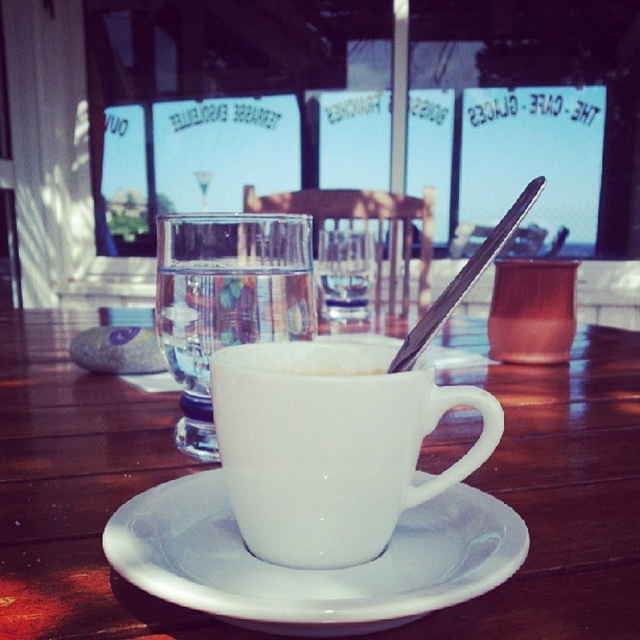
Question: Is the position of white ceramic cup at center less distant than that of clear glass water at center?

Choices:
 (A) yes
 (B) no

Answer: (A)

Question: Among these objects, which one is nearest to the camera?

Choices:
 (A) silver metallic spoon at upper center
 (B) white ceramic mug at center

Answer: (A)

Question: Is clear glass water at center further to the viewer compared to silver metallic spoon at upper center?

Choices:
 (A) yes
 (B) no

Answer: (A)

Question: Which of the following is the farthest from the observer?

Choices:
 (A) clear glass water at center
 (B) white ceramic cup at center
 (C) silver metallic spoon at upper center

Answer: (A)

Question: In this image, where is white ceramic mug at center located relative to silver metallic spoon at upper center?

Choices:
 (A) right
 (B) left

Answer: (B)

Question: Which object is positioned closest to the white glossy saucer at center?

Choices:
 (A) silver metallic spoon at upper center
 (B) white ceramic cup at center
 (C) clear glass water at center
 (D) white ceramic mug at center

Answer: (D)